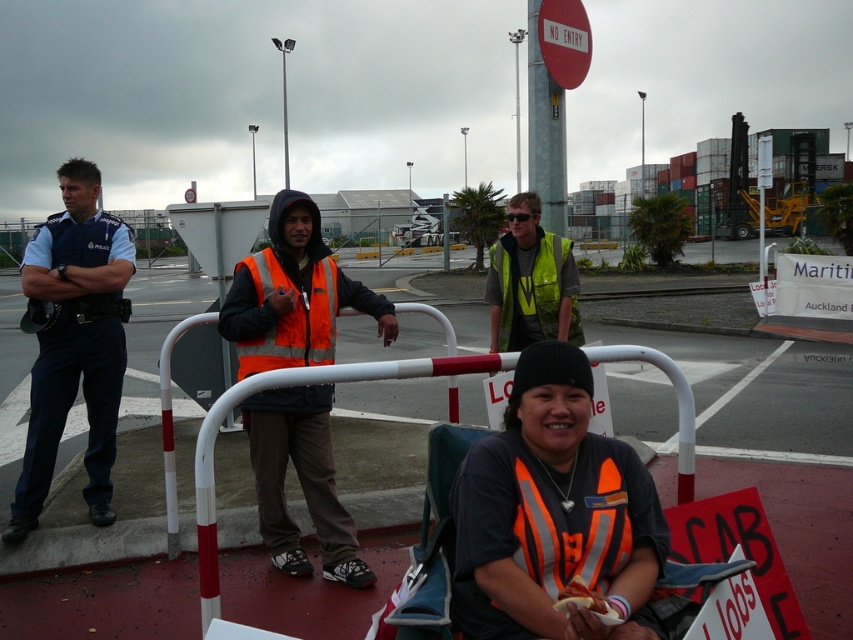
Question: Which of the following is the closest to the observer?

Choices:
 (A) (515, 387)
 (B) (321, 316)
 (C) (59, 237)
 (D) (247, 340)

Answer: (A)

Question: Does blue uniform at left have a lesser width compared to orange reflective safety vest at center?

Choices:
 (A) yes
 (B) no

Answer: (B)

Question: Which of the following is the closest to the observer?

Choices:
 (A) (483, 483)
 (B) (263, 256)
 (C) (561, 88)

Answer: (A)

Question: From the image, what is the correct spatial relationship of blue uniform at left in relation to orange reflective safety vest at center?

Choices:
 (A) left
 (B) right

Answer: (A)

Question: Is reflective orange vest at center bigger than blue uniform at left?

Choices:
 (A) yes
 (B) no

Answer: (B)

Question: Which object appears farthest from the camera in this image?

Choices:
 (A) orange reflective vest at center
 (B) reflective orange vest at center
 (C) orange reflective safety vest at center
 (D) metallic pole at upper center

Answer: (D)